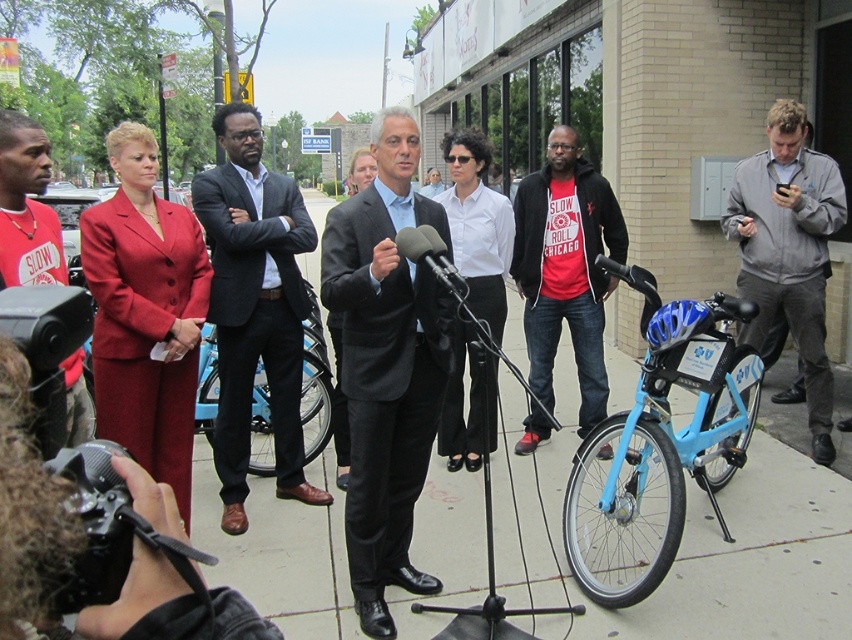
Is red cotton t-shirt at center to the left of matte black microphone at center from the viewer's perspective?

Incorrect, red cotton t-shirt at center is not on the left side of matte black microphone at center.

Find the location of a particular element. Image resolution: width=852 pixels, height=640 pixels. red cotton t-shirt at center is located at coordinates (566, 268).

Identify the location of red cotton t-shirt at center. (566, 268).

Measure the distance from matte red shirt at left to blue matte bicycle at center.

matte red shirt at left is 4.13 feet from blue matte bicycle at center.

Which of these two, matte red shirt at left or blue matte bicycle at center, stands shorter?

matte red shirt at left

Identify the location of matte red shirt at left. (26, 205).

Which is in front, point (226, 284) or point (542, 241)?

Point (226, 284) is more forward.

Image resolution: width=852 pixels, height=640 pixels. I want to click on dark blue suit at center, so click(254, 307).

Where is `dark blue suit at center`? The width and height of the screenshot is (852, 640). dark blue suit at center is located at coordinates (254, 307).